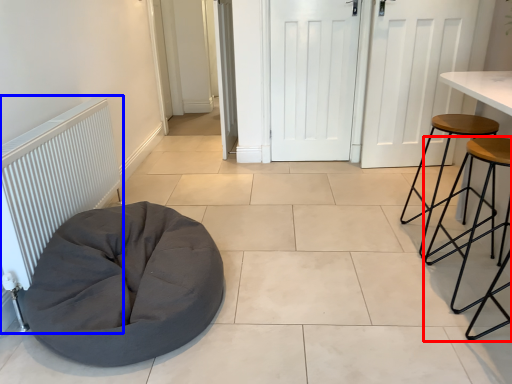
Question: Among these objects, which one is nearest to the camera, stool (highlighted by a red box) or radiator (highlighted by a blue box)?

Choices:
 (A) stool
 (B) radiator

Answer: (B)